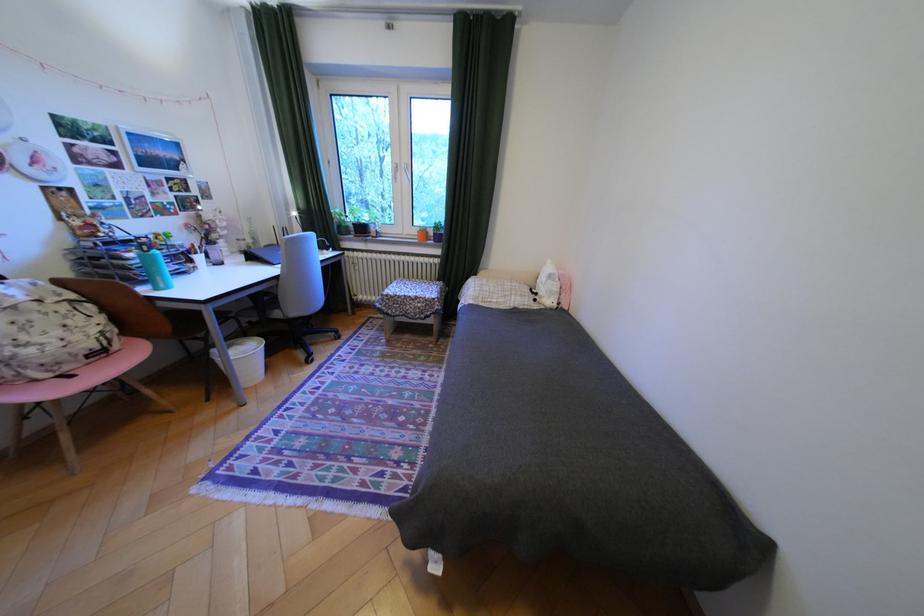
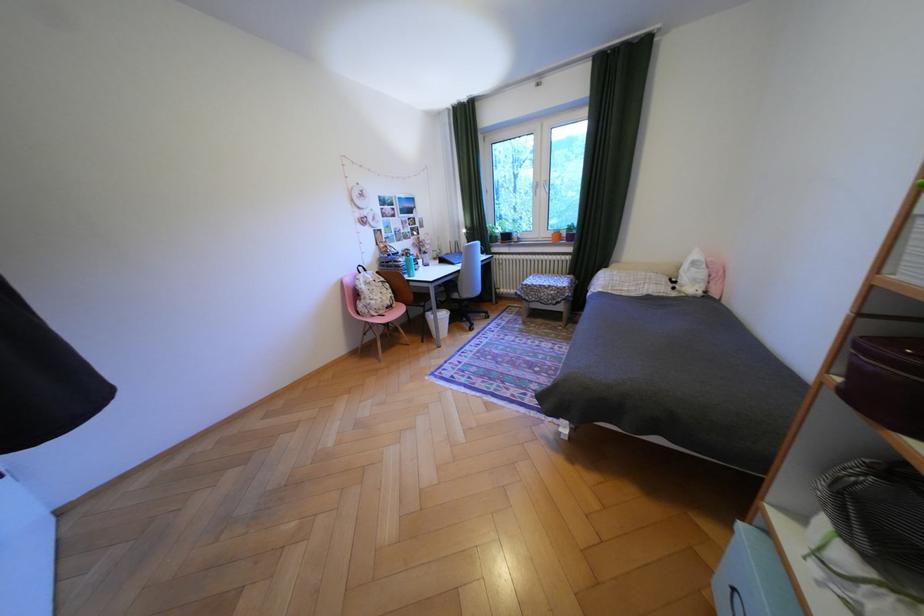
The point at (79, 368) is marked in the first image. Where is the corresponding point in the second image?

(393, 312)